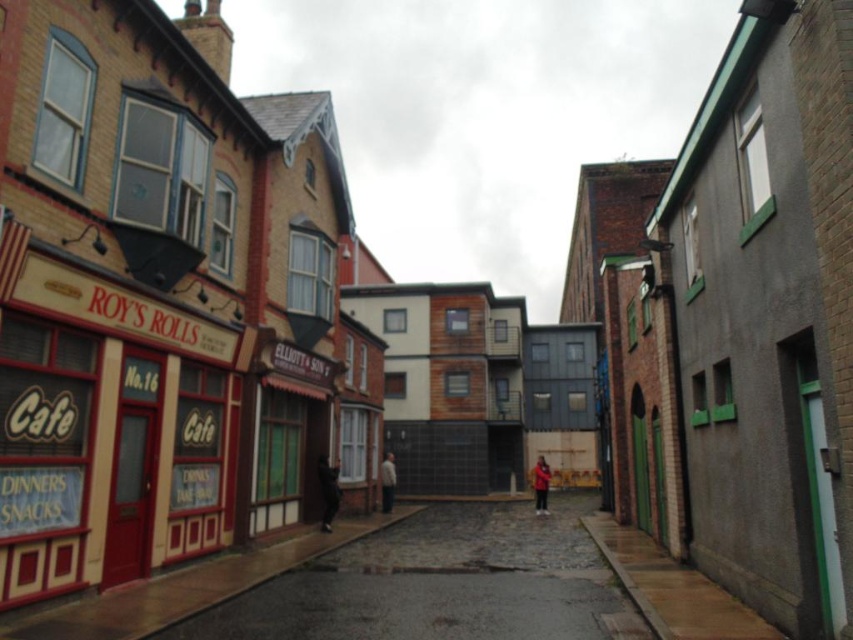
You are a costume designer preparing for a scene where two actors need to walk side by side through a narrow alley. The alley is only wide enough for one person. You have a dark gray fabric jacket at center and a red fabric coat at center. Which actor should wear which costume to ensure they can pass through the alley without the garments touching each other?

The dark gray fabric jacket at center is narrower than the red fabric coat at center. To ensure they can pass through the alley without the garments touching, the actor wearing the dark gray fabric jacket at center should go first, followed by the actor in the red fabric coat at center, or they can adjust their positions so the narrower jacket is on the side closer to the wall.

You are a costume designer examining the jackets in the image. The dark gray fabric jacket at center and the white matte jacket at center are both part of a costume set. Which jacket is positioned higher on the model?

The dark gray fabric jacket at center is located above the white matte jacket at center, so it is positioned higher on the model.